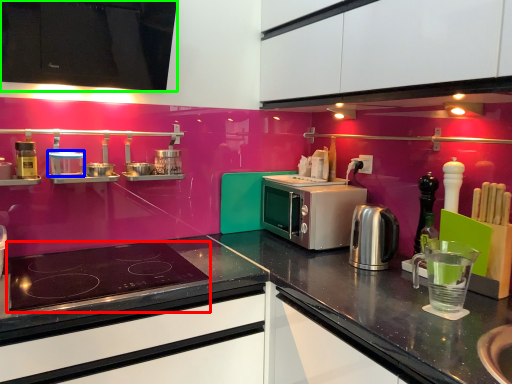
Question: Which object is the farthest from gas stove (highlighted by a red box)? Choose among these: appliance (highlighted by a blue box) or cabinetry (highlighted by a green box).

Choices:
 (A) appliance
 (B) cabinetry

Answer: (B)